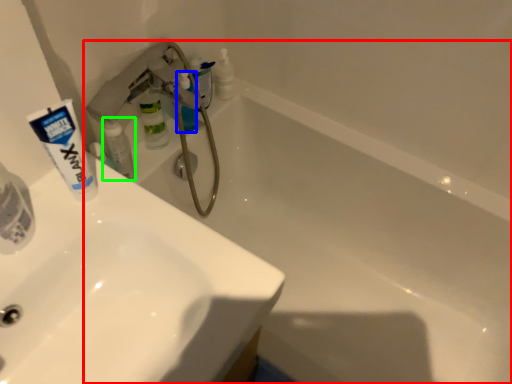
Question: Considering the real-world distances, which object is farthest from bathtub (highlighted by a red box)? toiletry (highlighted by a blue box) or toiletry (highlighted by a green box)?

Choices:
 (A) toiletry
 (B) toiletry

Answer: (B)